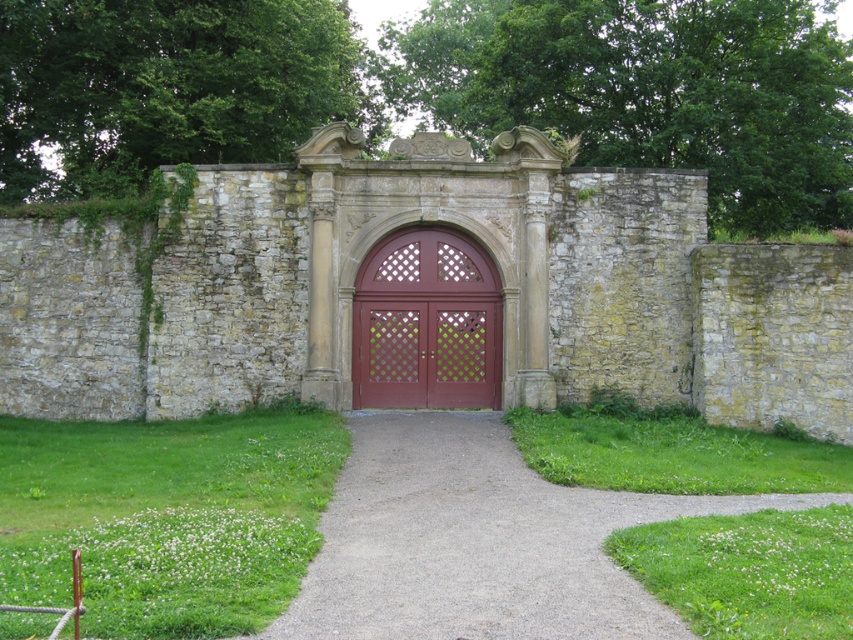
You are standing in front of the stone wall with the arched doorway. You see the gravel path at center and the matte wood door at center. Which object is located to the right of the other?

The gravel path at center is to the right of the matte wood door at center.

You are standing at the entrance of a historical building and need to carry a large wooden crate that is 2 meters wide. The crate must be placed directly in front of the door. Given the gravel path at center and the matte wood door at center, can you determine if the path is wide enough to accommodate the crate?

The gravel path at center might be wider than matte wood door at center. Since the door is part of the path, the path width could accommodate the 2m crate, but verify actual measurements to be sure.